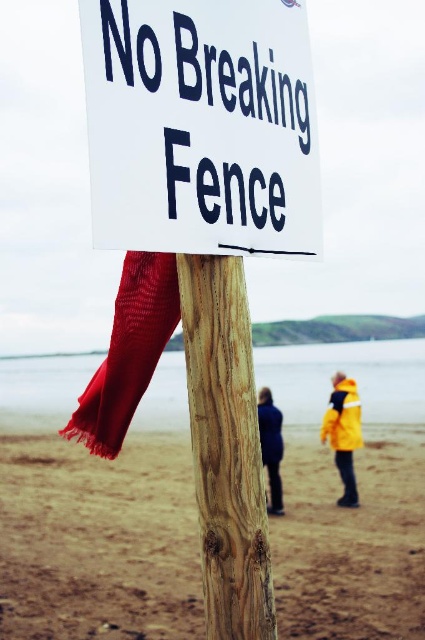
Question: Which object is the farthest from the wooden post at center?

Choices:
 (A) dark blue jacket at center
 (B) brown sandy beach at center
 (C) yellow matte jacket at lower right

Answer: (C)

Question: Does white plastic sign at center come behind wooden post at center?

Choices:
 (A) yes
 (B) no

Answer: (B)

Question: Which point is closer to the camera?

Choices:
 (A) (340, 442)
 (B) (277, 468)

Answer: (B)

Question: Among these objects, which one is farthest from the camera?

Choices:
 (A) dark blue jacket at center
 (B) yellow matte jacket at lower right

Answer: (A)

Question: Observing the image, what is the correct spatial positioning of yellow matte jacket at lower right in reference to dark blue jacket at center?

Choices:
 (A) left
 (B) right

Answer: (B)

Question: Is brown sandy beach at center below white plastic sign at center?

Choices:
 (A) no
 (B) yes

Answer: (B)